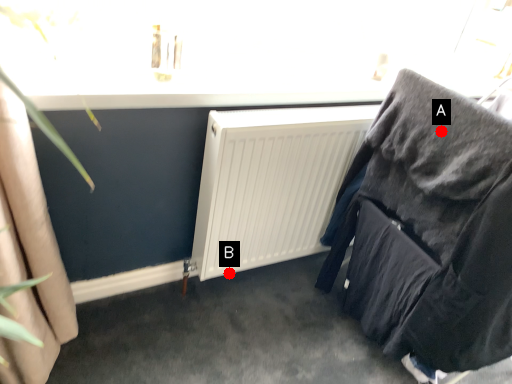
Question: Two points are circled on the image, labeled by A and B beside each circle. Which point is closer to the camera taking this photo?

Choices:
 (A) A is closer
 (B) B is closer

Answer: (A)